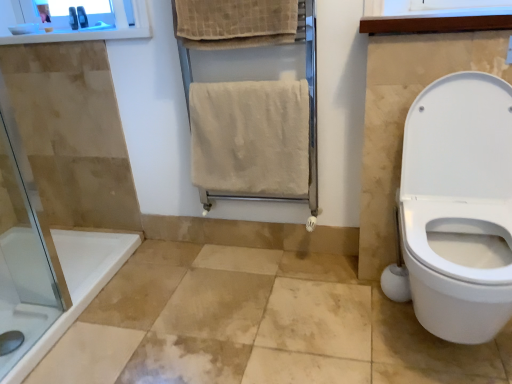
Question: Is beige towel rack at center positioned before beige textured towel at upper center, the 2th bath towel ordered from the bottom?

Choices:
 (A) yes
 (B) no

Answer: (B)

Question: Is beige towel rack at center located outside beige textured towel at upper center, the 1th bath towel viewed from the top?

Choices:
 (A) no
 (B) yes

Answer: (B)

Question: Would you say beige towel rack at center contains beige textured towel at upper center, the 2th bath towel ordered from the bottom?

Choices:
 (A) yes
 (B) no

Answer: (A)

Question: Is beige towel rack at center directly adjacent to beige textured towel at upper center, the 2th bath towel ordered from the bottom?

Choices:
 (A) yes
 (B) no

Answer: (B)

Question: Is beige towel rack at center further to camera compared to beige textured towel at upper center, the 2th bath towel ordered from the bottom?

Choices:
 (A) yes
 (B) no

Answer: (A)

Question: Which is correct: beige soft towel at center, the 2th bath towel in the top-to-bottom sequence, is inside wooden medicine cabinet at upper center, or outside of it?

Choices:
 (A) outside
 (B) inside

Answer: (A)

Question: In terms of height, does beige soft towel at center, which is the first bath towel from bottom to top, look taller or shorter compared to wooden medicine cabinet at upper center?

Choices:
 (A) short
 (B) tall

Answer: (B)

Question: Based on their sizes in the image, would you say beige soft towel at center, the 2th bath towel in the top-to-bottom sequence, is bigger or smaller than wooden medicine cabinet at upper center?

Choices:
 (A) small
 (B) big

Answer: (B)

Question: From the image's perspective, is beige soft towel at center, the 2th bath towel in the top-to-bottom sequence, above or below wooden medicine cabinet at upper center?

Choices:
 (A) above
 (B) below

Answer: (B)

Question: From their relative heights in the image, would you say beige towel rack at center is taller or shorter than white wood window frame at upper right?

Choices:
 (A) tall
 (B) short

Answer: (A)

Question: From a real-world perspective, is beige towel rack at center positioned above or below white wood window frame at upper right?

Choices:
 (A) above
 (B) below

Answer: (B)

Question: Is beige towel rack at center spatially inside white wood window frame at upper right, or outside of it?

Choices:
 (A) inside
 (B) outside

Answer: (B)

Question: In the image, is beige towel rack at center positioned in front of or behind white wood window frame at upper right?

Choices:
 (A) front
 (B) behind

Answer: (B)

Question: From a real-world perspective, is metallic gray razor at upper left, which appears as the second toiletry when viewed from the right, physically located above or below white wood window frame at upper right?

Choices:
 (A) above
 (B) below

Answer: (A)

Question: Is metallic gray razor at upper left, which appears as the second toiletry when viewed from the right, in front of or behind white wood window frame at upper right in the image?

Choices:
 (A) front
 (B) behind

Answer: (B)